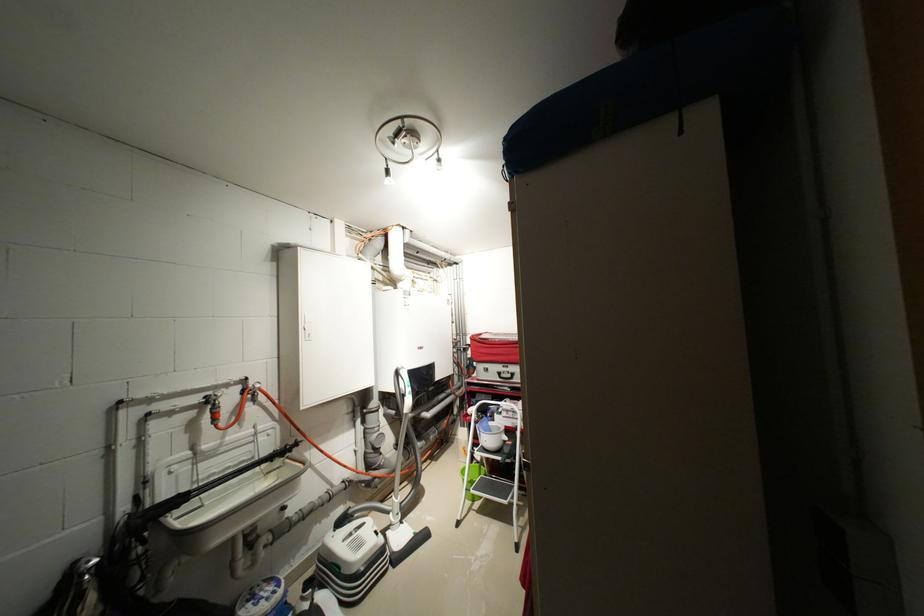
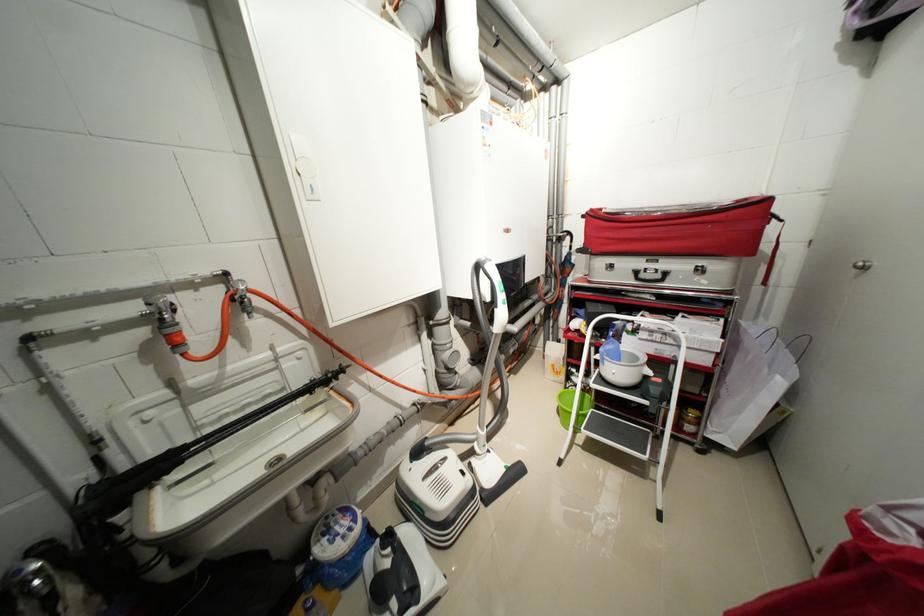
Where in the second image is the point corresponding to pixel 506 430 from the first image?

(642, 359)